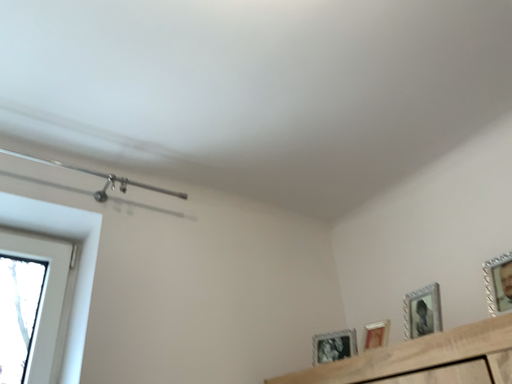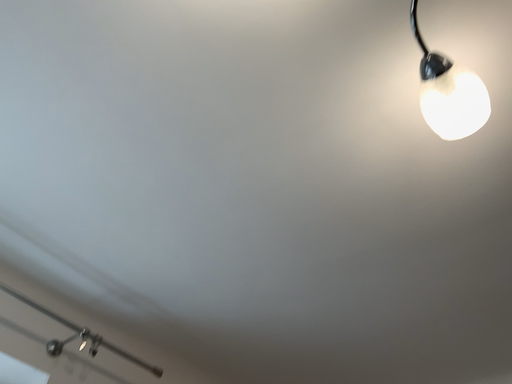
Question: Which way did the camera rotate in the video?

Choices:
 (A) rotated right
 (B) rotated left

Answer: (A)